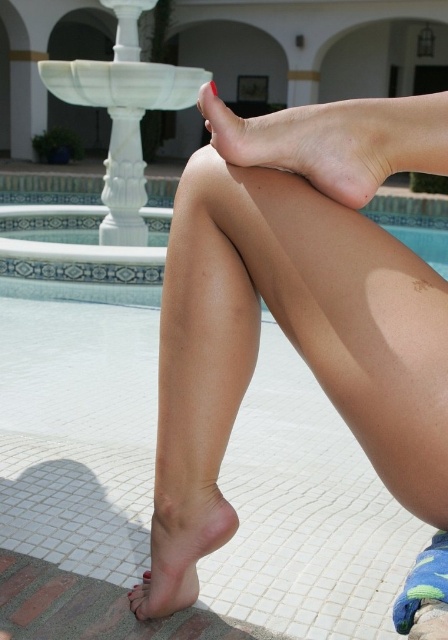
Question: Which of the following is the closest to the observer?

Choices:
 (A) pink matte skin at lower center
 (B) matte pink toe at lower left
 (C) smooth skin leg at lower center

Answer: (C)

Question: Considering the relative positions of blue tile swimming pool at center and pink matte skin at lower center in the image provided, where is blue tile swimming pool at center located with respect to pink matte skin at lower center?

Choices:
 (A) below
 (B) above

Answer: (B)

Question: Does smooth skin leg at lower center appear on the left side of matte pink toe at lower left?

Choices:
 (A) no
 (B) yes

Answer: (A)

Question: Among these objects, which one is farthest from the camera?

Choices:
 (A) smooth skin legs at center
 (B) white marble fountain at left
 (C) smooth skin leg at lower center

Answer: (B)

Question: Is blue tile swimming pool at center above matte pink toe at lower left?

Choices:
 (A) no
 (B) yes

Answer: (B)

Question: Which point is closer to the camera?

Choices:
 (A) matte pink toe at lower left
 (B) smooth skin foot at center
 (C) pink matte skin at lower center

Answer: (B)